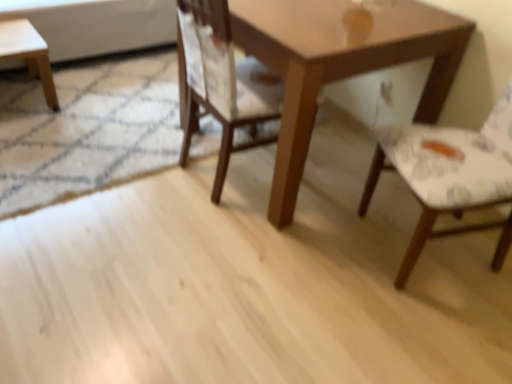
What are the coordinates of `vacant area that is in front of wooden table at center` in the screenshot? It's located at (283, 281).